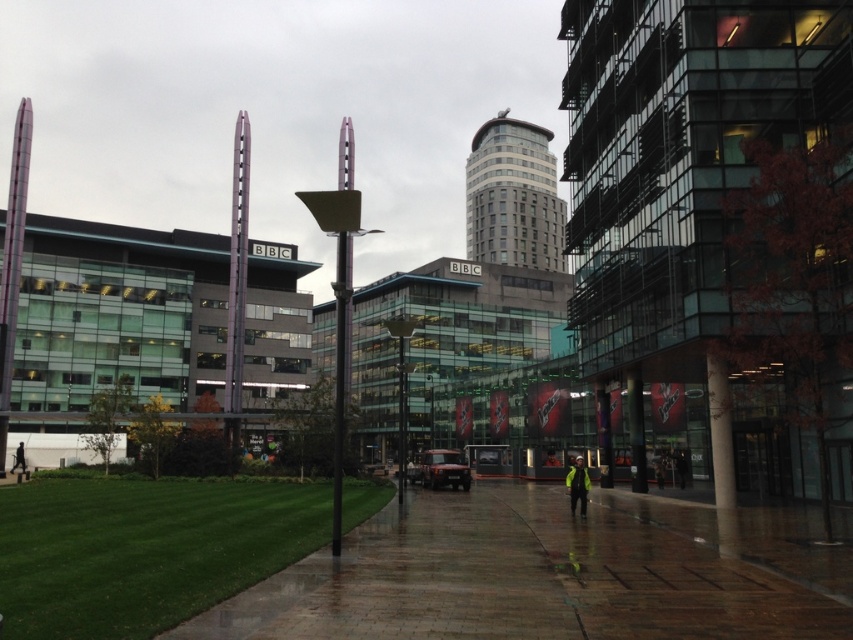
You are a pedestrian standing on the walkway in the urban scene. You notice two people wearing jackets. One is wearing a high visibility yellow jacket at center and the other a black jacket at lower left. Which jacket appears larger in size?

The high visibility yellow jacket at center appears larger than the black jacket at lower left according to the description.

In the scene shown: You are standing at the point with coordinates point (16, 449) and want to walk to the point with coordinates point (793, 532). Which direction should you face to walk towards your destination?

You should face north because point (793, 532) is in front of point (16, 449), indicating it is north of your current position.

You are a pedestrian standing on the shiny brick pavement at center and want to walk towards the high visibility yellow jacket at center. Which direction should you move?

You should move to the right because the shiny brick pavement at center is to the left of the high visibility yellow jacket at center.